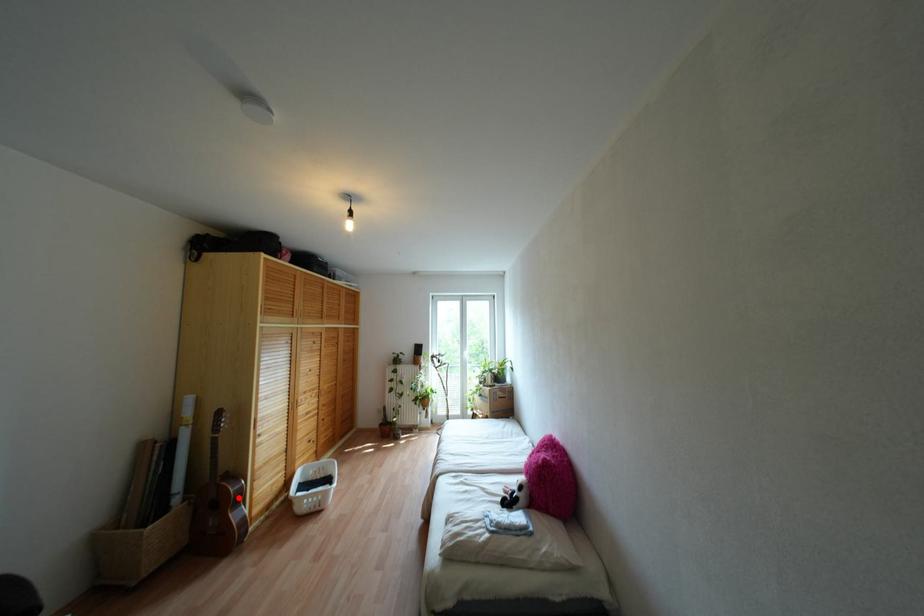
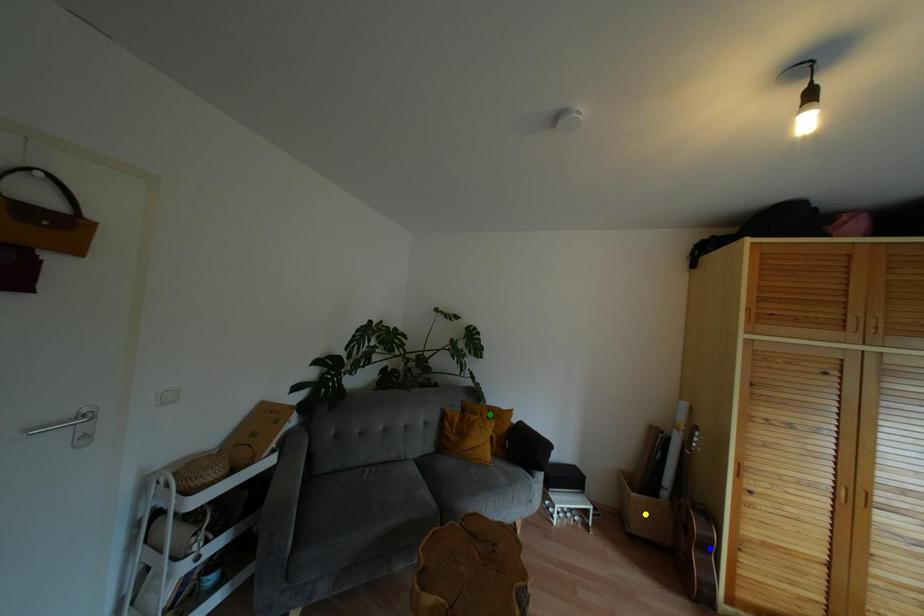
Question: I am providing you with two images of the same scene from different viewpoints. A red point is marked on the first image. You are given multiple points on the second image. In image 2, which mark is for the same physical point as the one in image 1?

Choices:
 (A) blue point
 (B) yellow point
 (C) green point

Answer: (A)